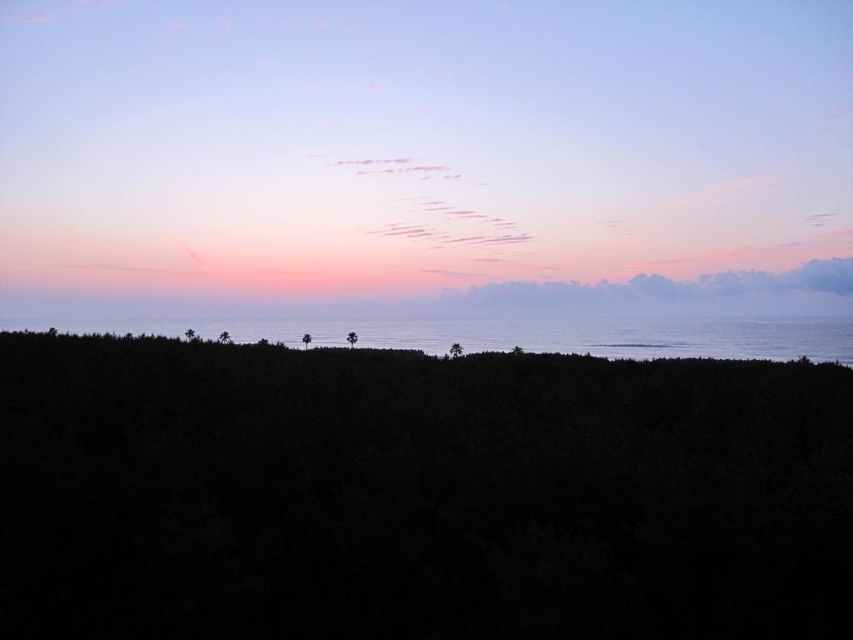
Question: In this image, where is dark green foliage at center located relative to silvery reflective water at center?

Choices:
 (A) left
 (B) right

Answer: (A)

Question: Which point is farther to the camera?

Choices:
 (A) dark green foliage at center
 (B) silvery reflective water at center
 (C) pastel sky at center

Answer: (C)

Question: Which object appears closest to the camera in this image?

Choices:
 (A) silvery reflective water at center
 (B) dark green foliage at center
 (C) pastel sky at center

Answer: (B)

Question: Does pastel sky at center appear on the right side of silvery reflective water at center?

Choices:
 (A) no
 (B) yes

Answer: (A)

Question: Which object is positioned farthest from the silvery reflective water at center?

Choices:
 (A) pastel sky at center
 (B) dark green foliage at center

Answer: (B)

Question: Observing the image, what is the correct spatial positioning of pastel sky at center in reference to dark green foliage at center?

Choices:
 (A) below
 (B) above

Answer: (B)